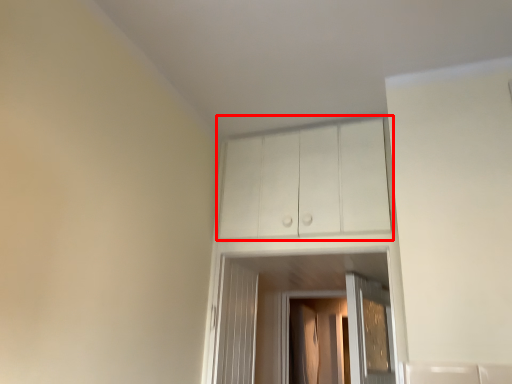
Question: From the image's perspective, what is the correct spatial positioning of cabinetry (annotated by the red box) in reference to screen door?

Choices:
 (A) above
 (B) below

Answer: (A)